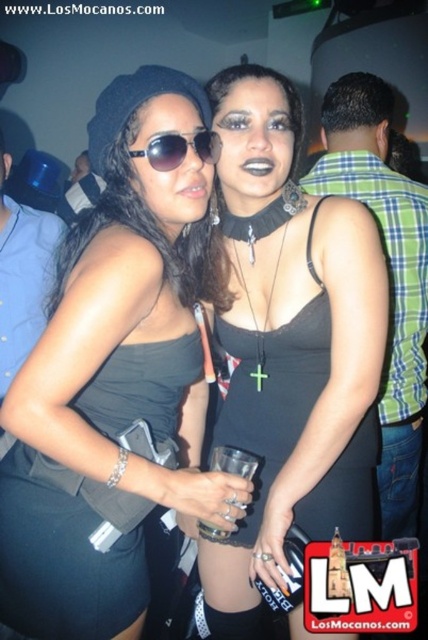
The height and width of the screenshot is (640, 428). Describe the element at coordinates (290, 346) in the screenshot. I see `black matte dress at center` at that location.

Does black matte dress at center appear under black satin dress at center?

Incorrect, black matte dress at center is not positioned below black satin dress at center.

Between point (234, 577) and point (33, 593), which one is positioned behind?

Point (234, 577)

The width and height of the screenshot is (428, 640). Find the location of `black matte dress at center`. black matte dress at center is located at coordinates (290, 346).

This screenshot has height=640, width=428. I want to click on black matte dress at center, so click(290, 346).

Who is shorter, black matte dress at center or sunglasses at center?

Standing shorter between the two is sunglasses at center.

Between point (250, 227) and point (158, 154), which one is positioned behind?

The point (250, 227) is behind.

The height and width of the screenshot is (640, 428). In order to click on black matte dress at center in this screenshot , I will do `click(290, 346)`.

Can you confirm if matte black dress at center is positioned above black matte dress at center?

Indeed, matte black dress at center is positioned over black matte dress at center.

Who is more forward, (50, 371) or (329, 285)?

Point (50, 371) is more forward.

Does point (9, 548) come closer to viewer compared to point (308, 320)?

That is True.

Identify the location of matte black dress at center. The height and width of the screenshot is (640, 428). (110, 369).